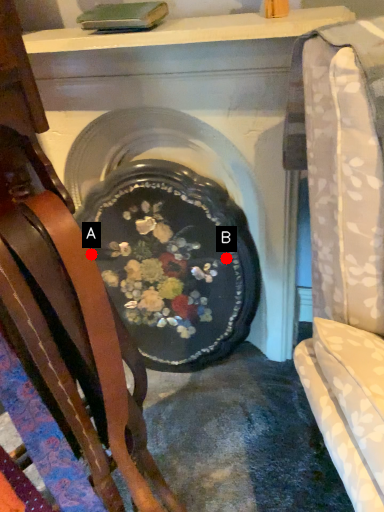
Question: Two points are circled on the image, labeled by A and B beside each circle. Which point is farther to the camera?

Choices:
 (A) A is further
 (B) B is further

Answer: (B)